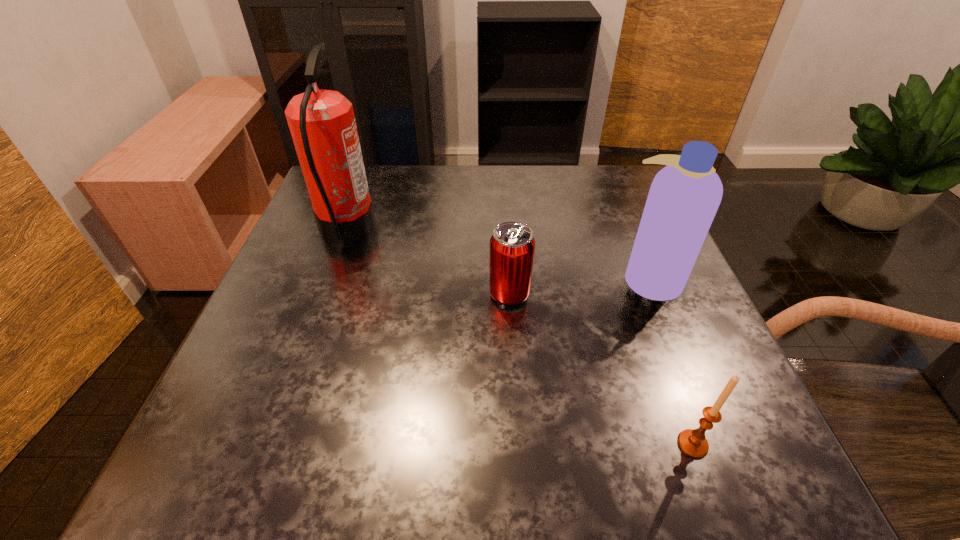
In order to click on object located at the near edge in this screenshot , I will do `click(693, 443)`.

This screenshot has width=960, height=540. What are the coordinates of `object located in the left edge section of the desktop` in the screenshot? It's located at (322, 124).

Where is `shampoo that is positioned at the right edge`? shampoo that is positioned at the right edge is located at coordinates (684, 196).

This screenshot has width=960, height=540. What are the coordinates of `candle_holder at the right edge` in the screenshot? It's located at (693, 443).

Where is `object that is at the far left corner`? The height and width of the screenshot is (540, 960). object that is at the far left corner is located at coordinates (322, 124).

Locate an element on the screen. object that is positioned at the near right corner is located at coordinates (693, 443).

Where is `vacant region at the far edge`? The height and width of the screenshot is (540, 960). vacant region at the far edge is located at coordinates point(411,180).

I want to click on vacant space at the near edge of the desktop, so click(322, 430).

The height and width of the screenshot is (540, 960). In order to click on vacant space at the left edge of the desktop in this screenshot , I will do tap(321, 276).

This screenshot has height=540, width=960. Find the location of `vacant region at the right edge of the desktop`. vacant region at the right edge of the desktop is located at coordinates (649, 319).